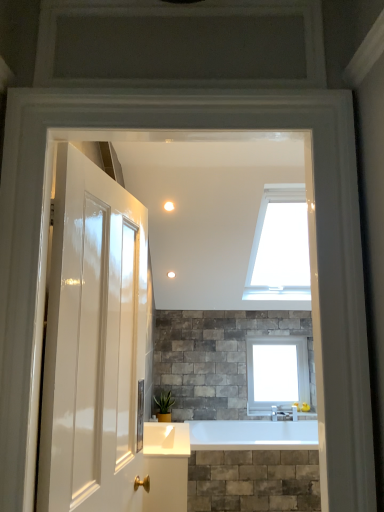
Image resolution: width=384 pixels, height=512 pixels. What are the coordinates of `green glossy plant at center` in the screenshot? It's located at click(x=164, y=402).

The image size is (384, 512). What do you see at coordinates (164, 402) in the screenshot? I see `green glossy plant at center` at bounding box center [164, 402].

In order to face green glossy plant at center, should I rotate leftwards or rightwards?

Rotate left and turn 3.768 degrees.

In order to click on white glass window at center in this screenshot , I will do `click(276, 373)`.

The image size is (384, 512). Describe the element at coordinates (276, 373) in the screenshot. I see `white glass window at center` at that location.

You are a GUI agent. You are given a task and a screenshot of the screen. Output one action in this format:
    pyautogui.click(x=<x>, y=<y>)
    Task: Click on the green glossy plant at center
    The image size is (384, 512).
    Given the screenshot: What is the action you would take?
    pyautogui.click(x=164, y=402)

Considering the positions of objects green glossy plant at center and white glass window at center in the image provided, who is more to the right, green glossy plant at center or white glass window at center?

Positioned to the right is white glass window at center.

Which object is more forward, green glossy plant at center or white glass window at center?

green glossy plant at center is closer to the camera.

Is point (165, 395) positioned in front of point (276, 341)?

Yes, it is in front of point (276, 341).

From the image's perspective, is green glossy plant at center positioned above or below white glass window at center?

green glossy plant at center is situated lower than white glass window at center in the image.

From a real-world perspective, relative to white glass window at center, is green glossy plant at center vertically above or below?

green glossy plant at center is below white glass window at center.

Between green glossy plant at center and white glass window at center, which one has larger width?

With larger width is green glossy plant at center.

Is green glossy plant at center taller than white glass window at center?

Incorrect, the height of green glossy plant at center is not larger of that of white glass window at center.

Between green glossy plant at center and white glass window at center, which one has larger size?

white glass window at center.

Would you say white glass window at center is part of green glossy plant at center's contents?

No.

Is green glossy plant at center positioned far away from white glass window at center?

Yes, green glossy plant at center and white glass window at center are quite far apart.

Is green glossy plant at center looking in the opposite direction of white glass window at center?

No, white glass window at center is not at the back of green glossy plant at center.

How much distance is there between green glossy plant at center and white glass window at center?

They are 3.53 feet apart.

Where is `plant that is below the white glass window at center (from the image's perspective)`? plant that is below the white glass window at center (from the image's perspective) is located at coordinates (164, 402).

Does white glass window at center appear on the right side of green glossy plant at center?

Indeed, white glass window at center is positioned on the right side of green glossy plant at center.

Is the position of white glass window at center less distant than that of green glossy plant at center?

No, white glass window at center is further to the viewer.

Which is farther from the camera, (252, 395) or (160, 400)?

The point (252, 395) is behind.

From the image's perspective, relative to green glossy plant at center, is white glass window at center above or below?

white glass window at center is above green glossy plant at center.

From a real-world perspective, is white glass window at center above or below green glossy plant at center?

In terms of real-world spatial position, white glass window at center is above green glossy plant at center.

Is white glass window at center wider or thinner than green glossy plant at center?

In the image, white glass window at center appears to be more narrow than green glossy plant at center.

Who is shorter, white glass window at center or green glossy plant at center?

green glossy plant at center is shorter.

Is white glass window at center bigger than green glossy plant at center?

Yes.

Would you say white glass window at center is outside green glossy plant at center?

That's correct, white glass window at center is outside of green glossy plant at center.

Are white glass window at center and green glossy plant at center far apart?

Yes.

Is white glass window at center oriented towards green glossy plant at center?

No, white glass window at center is not facing towards green glossy plant at center.

Where is `window lying above the green glossy plant at center (from the image's perspective)`? The height and width of the screenshot is (512, 384). window lying above the green glossy plant at center (from the image's perspective) is located at coordinates (276, 373).

Locate an element on the screen. The height and width of the screenshot is (512, 384). plant in front of the white glass window at center is located at coordinates (164, 402).

Where is `plant that appears on the left of white glass window at center`? plant that appears on the left of white glass window at center is located at coordinates (164, 402).